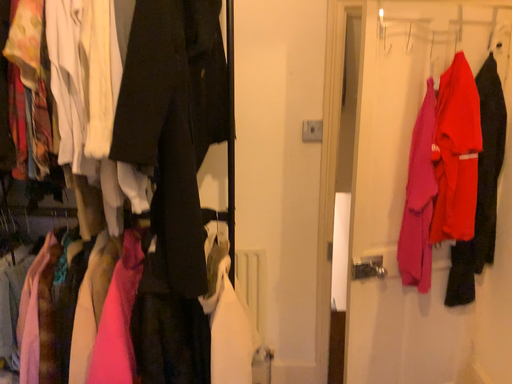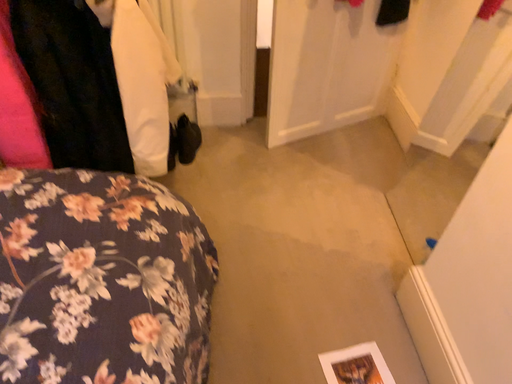
Question: How did the camera likely rotate when shooting the video?

Choices:
 (A) rotated downward
 (B) rotated upward

Answer: (A)